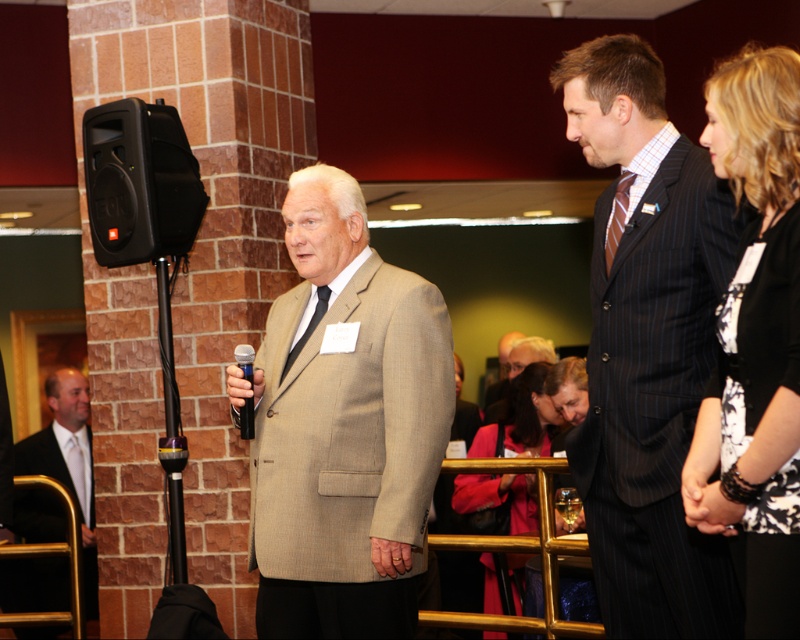
You are an event organizer who needs to ensure that the striped silk tie at center and the black plastic microphone at center are visible to the audience. Since the microphone is crucial for the speaker, should you adjust their positions to make sure the microphone is more prominent?

The striped silk tie at center is wider than the black plastic microphone at center, so the microphone might already be sufficiently visible. No adjustment is needed unless other factors interfere.

You are a photographer at the event, and you need to capture a group photo of the dark pinstripe suit at center and the matte pink coat at center. Your camera can focus on subjects within 8 feet. Will both subjects be in focus?

The distance between the dark pinstripe suit at center and the matte pink coat at center is 8.15 feet, which exceeds the camera focus range of 8 feet. Therefore, both subjects cannot be in focus simultaneously.